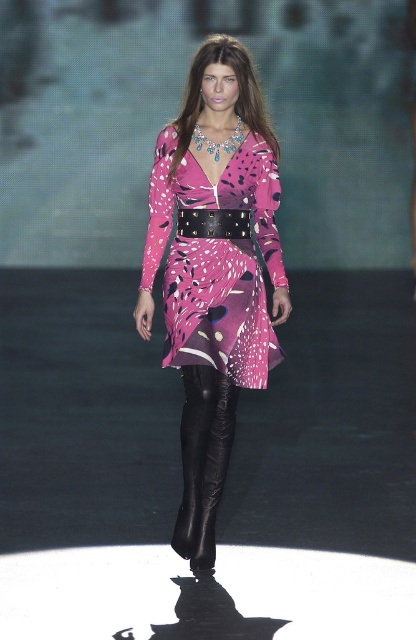
Question: Which of these objects is positioned farthest from the black leather belt at center?

Choices:
 (A) black leather pants at center
 (B) pink satin dress at center

Answer: (A)

Question: Which object appears farthest from the camera in this image?

Choices:
 (A) black leather pants at center
 (B) pink satin dress at center
 (C) pink printed fabric dress at center
 (D) black leather belt at center

Answer: (D)

Question: Which object is positioned farthest from the black leather belt at center?

Choices:
 (A) pink satin dress at center
 (B) pink printed fabric dress at center
 (C) black leather pants at center

Answer: (C)

Question: Can you confirm if pink satin dress at center is bigger than pink printed fabric dress at center?

Choices:
 (A) yes
 (B) no

Answer: (A)

Question: From the image, what is the correct spatial relationship of pink satin dress at center in relation to black leather pants at center?

Choices:
 (A) above
 (B) below

Answer: (A)

Question: Can you confirm if pink satin dress at center is wider than black leather pants at center?

Choices:
 (A) yes
 (B) no

Answer: (A)